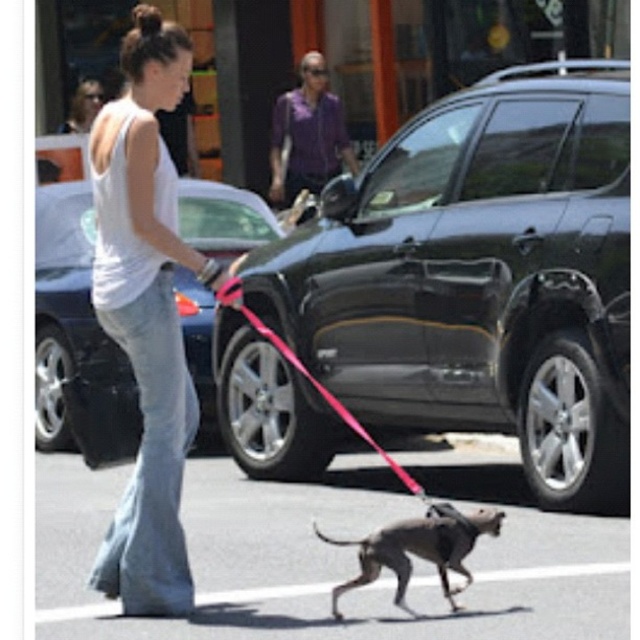
Question: Is white cotton tank top at center bigger than shiny black car at center?

Choices:
 (A) yes
 (B) no

Answer: (B)

Question: Which point is farther to the camera?

Choices:
 (A) (404, 474)
 (B) (477, 534)
 (C) (176, 227)

Answer: (A)

Question: Is white cotton tank top at center to the left of shiny black car at center from the viewer's perspective?

Choices:
 (A) yes
 (B) no

Answer: (B)

Question: Can you confirm if white cotton tank top at center is wider than shiny black car at center?

Choices:
 (A) yes
 (B) no

Answer: (B)

Question: Which point is closer to the camera?

Choices:
 (A) shiny black suv at center
 (B) pink nylon leash at center
 (C) shiny black car at center

Answer: (B)

Question: Which point is farther to the camera?

Choices:
 (A) (344, 544)
 (B) (51, 417)
 (C) (616, 316)
 (D) (188, 264)

Answer: (B)